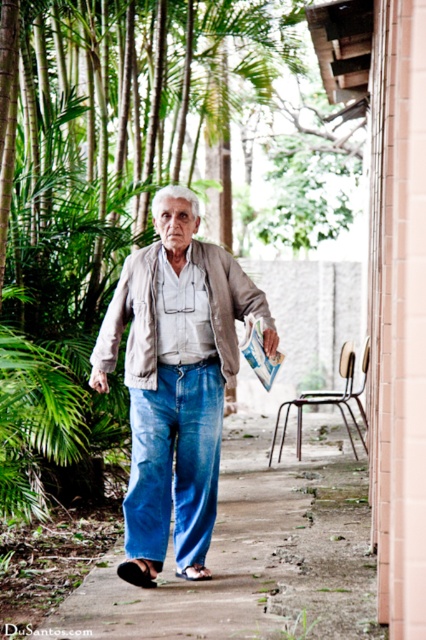
Question: Does denim pants at center have a smaller size compared to blue denim jeans at center?

Choices:
 (A) yes
 (B) no

Answer: (B)

Question: Which is nearer to the leather jacket at center?

Choices:
 (A) blue denim pants at center
 (B) black leather sandal at lower left

Answer: (B)

Question: Which object appears closest to the camera in this image?

Choices:
 (A) blue denim jeans at center
 (B) blue denim pants at center

Answer: (B)

Question: Estimate the real-world distances between objects in this image. Which object is farther from the denim pants at center?

Choices:
 (A) leather jacket at center
 (B) blue denim jeans at center

Answer: (A)

Question: Can you confirm if blue denim jeans at center is smaller than leather jacket at center?

Choices:
 (A) yes
 (B) no

Answer: (A)

Question: Can you confirm if blue denim pants at center is smaller than black fabric sandal at lower center?

Choices:
 (A) no
 (B) yes

Answer: (A)